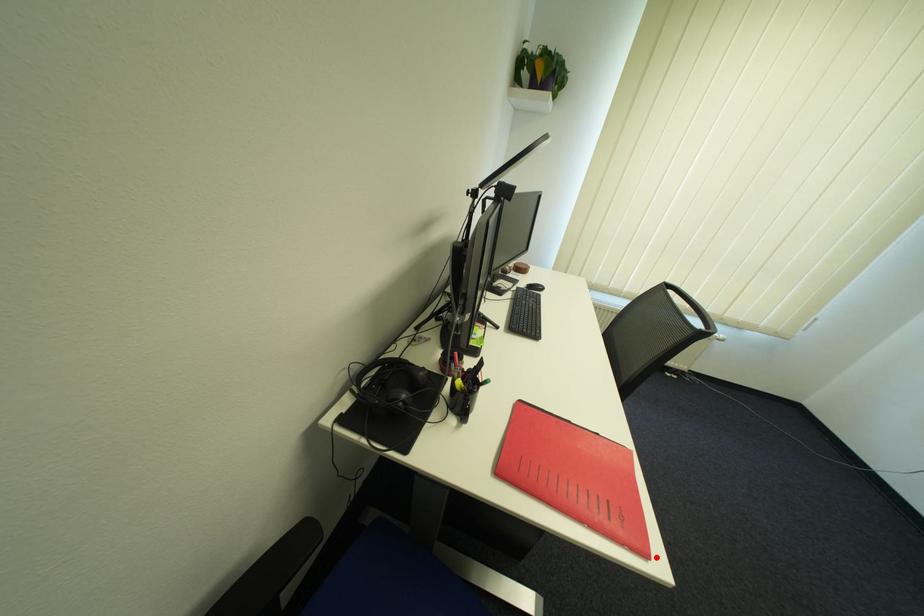
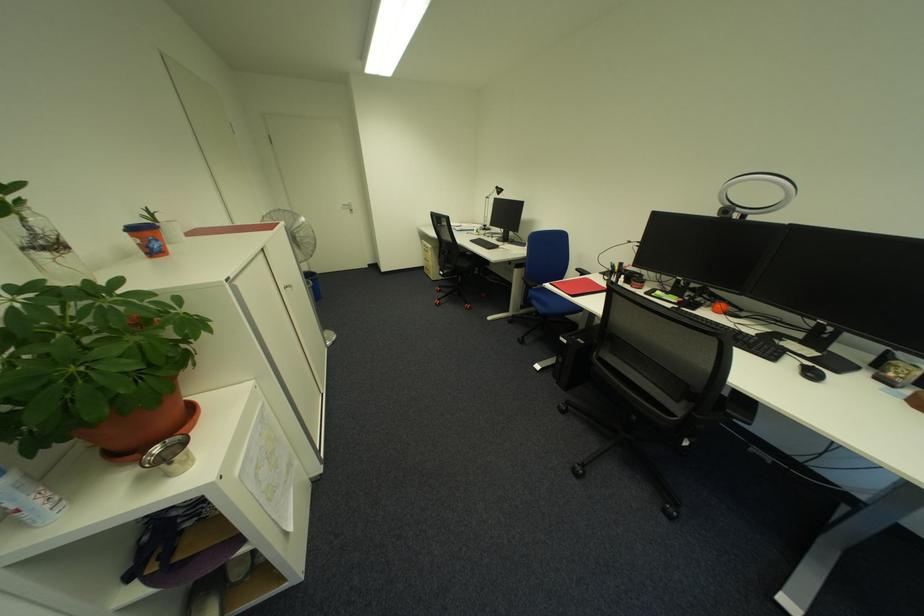
The point at the highlighted location is marked in the first image. Where is the corresponding point in the second image?

(560, 285)